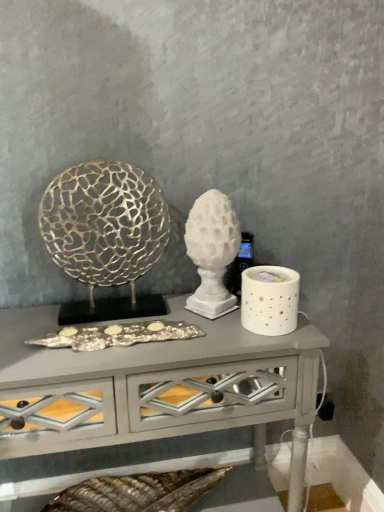
Describe the element at coordinates (212, 252) in the screenshot. I see `white matte sculpture at center, which ranks as the 2th sculpture in left-to-right order` at that location.

What is the approximate height of white glossy table at center?

It is 75.21 centimeters.

This screenshot has height=512, width=384. Describe the element at coordinates (155, 386) in the screenshot. I see `white glossy table at center` at that location.

What is the approximate width of white ceramic candle holder at right?

white ceramic candle holder at right is 5.50 inches in width.

You are a GUI agent. You are given a task and a screenshot of the screen. Output one action in this format:
    pyautogui.click(x=<x>, y=<y>)
    Task: Click on the white ceramic candle holder at right
    The height and width of the screenshot is (512, 384).
    Given the screenshot: What is the action you would take?
    pyautogui.click(x=269, y=300)

What is the approximate height of gold textured sculpture at left, the 1th sculpture positioned from the left?

It is 15.06 inches.

Identify the location of white matte sculpture at center, placed as the first sculpture when sorted from right to left. The image size is (384, 512). (212, 252).

Does white ceramic candle holder at right have a lesser width compared to white glossy table at center?

Indeed, white ceramic candle holder at right has a lesser width compared to white glossy table at center.

Can you tell me how much white ceramic candle holder at right and white glossy table at center differ in facing direction?

The angular difference between white ceramic candle holder at right and white glossy table at center is 0.0011 degrees.

From the image's perspective, which object appears higher, white ceramic candle holder at right or white glossy table at center?

white ceramic candle holder at right is shown above in the image.

Is white ceramic candle holder at right inside or outside of white glossy table at center?

white ceramic candle holder at right is not enclosed by white glossy table at center.

In terms of height, does white matte sculpture at center, placed as the first sculpture when sorted from right to left, look taller or shorter compared to white glossy table at center?

white matte sculpture at center, placed as the first sculpture when sorted from right to left, is shorter than white glossy table at center.

How many degrees apart are the facing directions of white matte sculpture at center, which ranks as the 2th sculpture in left-to-right order, and white glossy table at center?

The angular difference between white matte sculpture at center, which ranks as the 2th sculpture in left-to-right order, and white glossy table at center is 0.000907 degrees.

Does white matte sculpture at center, which ranks as the 2th sculpture in left-to-right order, have a larger size compared to white glossy table at center?

No.

Could you measure the distance between white matte sculpture at center, placed as the first sculpture when sorted from right to left, and white glossy table at center?

8.87 inches.

From the image's perspective, is white matte sculpture at center, which ranks as the 2th sculpture in left-to-right order, located above or below white ceramic candle holder at right?

Clearly, from the image's perspective, white matte sculpture at center, which ranks as the 2th sculpture in left-to-right order, is above white ceramic candle holder at right.

Is white matte sculpture at center, which ranks as the 2th sculpture in left-to-right order, positioned with its back to white ceramic candle holder at right?

No, white matte sculpture at center, which ranks as the 2th sculpture in left-to-right order,'s orientation is not away from white ceramic candle holder at right.

In the scene shown: Can you tell me how much white matte sculpture at center, placed as the first sculpture when sorted from right to left, and white ceramic candle holder at right differ in facing direction?

white matte sculpture at center, placed as the first sculpture when sorted from right to left, and white ceramic candle holder at right are facing 0.002 degrees away from each other.

Is white matte sculpture at center, which ranks as the 2th sculpture in left-to-right order, completely or partially outside of white ceramic candle holder at right?

Yes.

From a real-world perspective, is white glossy table at center under white ceramic candle holder at right?

Indeed, from a real-world perspective, white glossy table at center is positioned beneath white ceramic candle holder at right.

Would you say white glossy table at center is to the left or to the right of white ceramic candle holder at right in the picture?

From the image, it's evident that white glossy table at center is to the left of white ceramic candle holder at right.

From the image's perspective, is white glossy table at center located beneath white ceramic candle holder at right?

Yes.

Locate an element on the screen. This screenshot has height=512, width=384. table that is in front of the white ceramic candle holder at right is located at coordinates (155, 386).

Is gold textured sculpture at left, the 1th sculpture positioned from the left, oriented towards white ceramic candle holder at right?

No, gold textured sculpture at left, the 1th sculpture positioned from the left, is not turned towards white ceramic candle holder at right.

Locate an element on the screen. The width and height of the screenshot is (384, 512). the 2nd sculpture above the white ceramic candle holder at right (from the image's perspective) is located at coordinates (105, 234).

From a real-world perspective, which is physically above, gold textured sculpture at left, which ranks as the second sculpture in right-to-left order, or white ceramic candle holder at right?

From a 3D spatial view, gold textured sculpture at left, which ranks as the second sculpture in right-to-left order, is above.

Is gold textured sculpture at left, the 1th sculpture positioned from the left, smaller than white ceramic candle holder at right?

Actually, gold textured sculpture at left, the 1th sculpture positioned from the left, might be larger than white ceramic candle holder at right.

Choose the correct answer: Is gold textured sculpture at left, which ranks as the second sculpture in right-to-left order, inside white glossy table at center or outside it?

gold textured sculpture at left, which ranks as the second sculpture in right-to-left order, is outside white glossy table at center.

Would you say gold textured sculpture at left, the 1th sculpture positioned from the left, is to the left or to the right of white glossy table at center in the picture?

Clearly, gold textured sculpture at left, the 1th sculpture positioned from the left, is on the left of white glossy table at center in the image.

Considering the positions of points (160, 229) and (35, 426), is point (160, 229) farther from camera compared to point (35, 426)?

Yes, point (160, 229) is farther from viewer.

Are white glossy table at center and gold textured sculpture at left, the 1th sculpture positioned from the left, making contact?

No, white glossy table at center is not in contact with gold textured sculpture at left, the 1th sculpture positioned from the left.

From the image's perspective, between white glossy table at center and gold textured sculpture at left, which ranks as the second sculpture in right-to-left order, who is located below?

From the image's view, white glossy table at center is below.

From a real-world perspective, who is located lower, white glossy table at center or gold textured sculpture at left, the 1th sculpture positioned from the left?

white glossy table at center.

Does white glossy table at center appear on the left side of gold textured sculpture at left, which ranks as the second sculpture in right-to-left order?

Incorrect, white glossy table at center is not on the left side of gold textured sculpture at left, which ranks as the second sculpture in right-to-left order.

At what (x,y) coordinates should I click in order to perform the action: click on table beneath the white ceramic candle holder at right (from a real-world perspective). Please return your answer as a coordinate pair (x, y). Looking at the image, I should click on (155, 386).

At what (x,y) coordinates should I click in order to perform the action: click on the 1st sculpture above when counting from the white glossy table at center (from the image's perspective). Please return your answer as a coordinate pair (x, y). Image resolution: width=384 pixels, height=512 pixels. Looking at the image, I should click on (212, 252).

Considering their positions, is white ceramic candle holder at right positioned further to white glossy table at center than white matte sculpture at center, which ranks as the 2th sculpture in left-to-right order?

white ceramic candle holder at right is positioned further to the anchor white glossy table at center.

Based on their spatial positions, is white matte sculpture at center, placed as the first sculpture when sorted from right to left, or gold textured sculpture at left, which ranks as the second sculpture in right-to-left order, further from white ceramic candle holder at right?

gold textured sculpture at left, which ranks as the second sculpture in right-to-left order, is further to white ceramic candle holder at right.

Estimate the real-world distances between objects in this image. Which object is closer to white matte sculpture at center, which ranks as the 2th sculpture in left-to-right order, white ceramic candle holder at right or white glossy table at center?

The object closer to white matte sculpture at center, which ranks as the 2th sculpture in left-to-right order, is white ceramic candle holder at right.

Based on their spatial positions, is white matte sculpture at center, placed as the first sculpture when sorted from right to left, or white glossy table at center further from gold textured sculpture at left, the 1th sculpture positioned from the left?

white glossy table at center lies further to gold textured sculpture at left, the 1th sculpture positioned from the left, than the other object.

Estimate the real-world distances between objects in this image. Which object is closer to white glossy table at center, white ceramic candle holder at right or gold textured sculpture at left, the 1th sculpture positioned from the left?

gold textured sculpture at left, the 1th sculpture positioned from the left.

In the scene shown: When comparing their distances from white matte sculpture at center, placed as the first sculpture when sorted from right to left, does white glossy table at center or gold textured sculpture at left, which ranks as the second sculpture in right-to-left order, seem closer?

Among the two, gold textured sculpture at left, which ranks as the second sculpture in right-to-left order, is located nearer to white matte sculpture at center, placed as the first sculpture when sorted from right to left.

Based on their spatial positions, is white glossy table at center or gold textured sculpture at left, the 1th sculpture positioned from the left, further from white ceramic candle holder at right?

The object further to white ceramic candle holder at right is gold textured sculpture at left, the 1th sculpture positioned from the left.

Estimate the real-world distances between objects in this image. Which object is further from white ceramic candle holder at right, white glossy table at center or white matte sculpture at center, which ranks as the 2th sculpture in left-to-right order?

white glossy table at center.

Find the location of `candle holder between white matte sculpture at center, placed as the first sculpture when sorted from right to left, and white glossy table at center in the up-down direction`. candle holder between white matte sculpture at center, placed as the first sculpture when sorted from right to left, and white glossy table at center in the up-down direction is located at coordinates (269, 300).

At what (x,y) coordinates should I click in order to perform the action: click on sculpture situated between gold textured sculpture at left, the 1th sculpture positioned from the left, and white ceramic candle holder at right from left to right. Please return your answer as a coordinate pair (x, y). This screenshot has height=512, width=384. Looking at the image, I should click on click(x=212, y=252).

Find the location of a particular element. The image size is (384, 512). sculpture between gold textured sculpture at left, the 1th sculpture positioned from the left, and white glossy table at center from top to bottom is located at coordinates (212, 252).

Find the location of a particular element. This screenshot has width=384, height=512. candle holder that lies between gold textured sculpture at left, which ranks as the second sculpture in right-to-left order, and white glossy table at center from top to bottom is located at coordinates (269, 300).